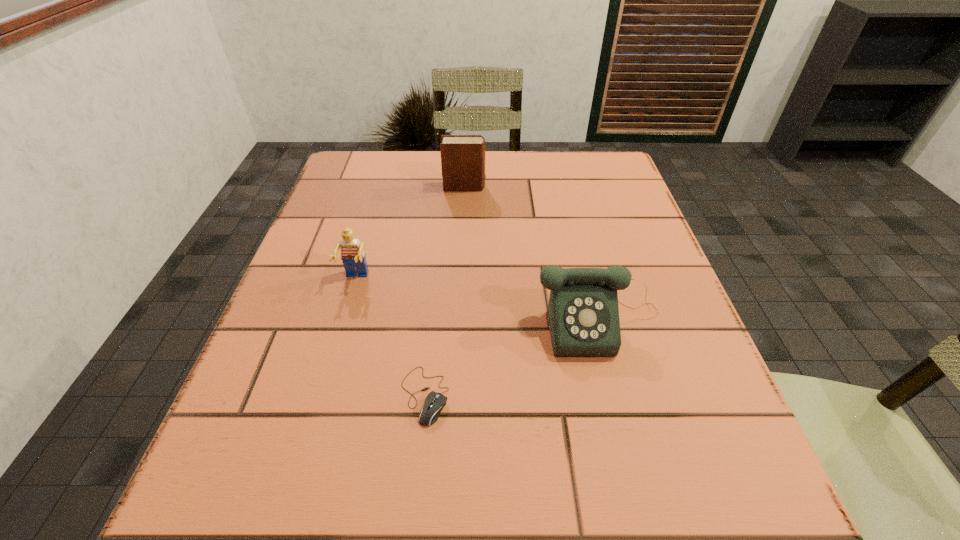
Find the location of a particular element. This screenshot has height=540, width=960. vacant space situated 0.260m on the back of the shortest object is located at coordinates (438, 263).

You are a GUI agent. You are given a task and a screenshot of the screen. Output one action in this format:
    pyautogui.click(x=<x>, y=<y>)
    Task: Click on the object located at the far edge
    
    Given the screenshot: What is the action you would take?
    pyautogui.click(x=462, y=156)

Image resolution: width=960 pixels, height=540 pixels. I want to click on object at the left edge, so point(353,257).

Locate an element on the screen. Image resolution: width=960 pixels, height=540 pixels. object present at the right edge is located at coordinates (583, 313).

Where is `free space at the far edge of the desktop`? This screenshot has width=960, height=540. free space at the far edge of the desktop is located at coordinates (530, 198).

In the image, there is a desktop. Where is `vacant space at the left edge`? vacant space at the left edge is located at coordinates (326, 211).

Identify the location of vacant space at the right edge of the desktop. The height and width of the screenshot is (540, 960). (592, 213).

Locate an element on the screen. vacant space at the far left corner of the desktop is located at coordinates [x=359, y=163].

Where is `blank space at the near left corner`? This screenshot has width=960, height=540. blank space at the near left corner is located at coordinates (270, 491).

You are a GUI agent. You are given a task and a screenshot of the screen. Output one action in this format:
    pyautogui.click(x=<x>, y=<y>)
    Task: Click on the free space at the far right corner of the desktop
    The width and height of the screenshot is (960, 540).
    Given the screenshot: What is the action you would take?
    pyautogui.click(x=563, y=161)